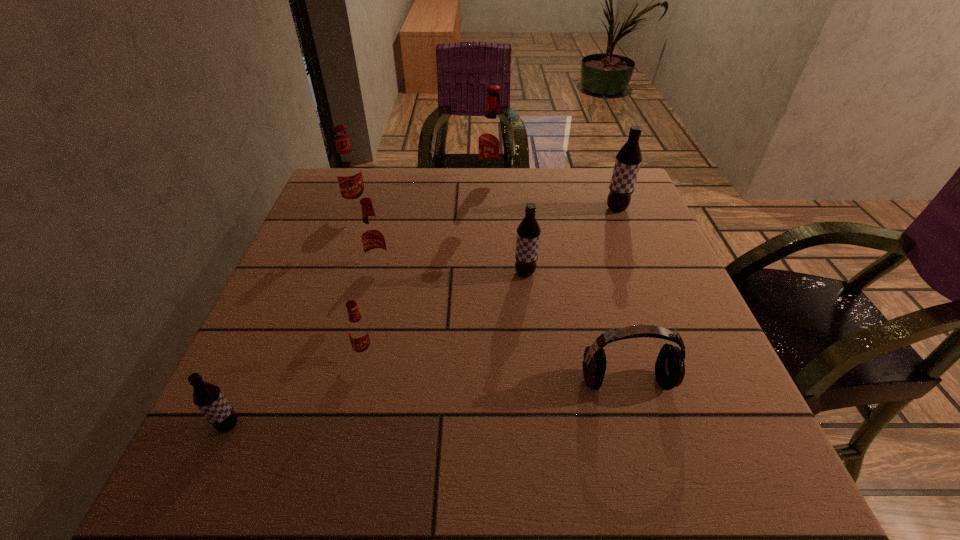
Image resolution: width=960 pixels, height=540 pixels. What are the coordinates of `the biggest red root beer` in the screenshot? It's located at (492, 139).

The width and height of the screenshot is (960, 540). Find the location of `the rightmost red root beer`. the rightmost red root beer is located at coordinates (492, 139).

The height and width of the screenshot is (540, 960). Identify the location of the seventh object from right to left. (348, 170).

Where is `the second root beer from left to right`? This screenshot has width=960, height=540. the second root beer from left to right is located at coordinates (348, 170).

Find the location of a particular element. the rightmost root beer is located at coordinates (628, 159).

Where is `the biggest brown root beer`? This screenshot has width=960, height=540. the biggest brown root beer is located at coordinates (628, 159).

Find the location of `the second smallest red root beer`. the second smallest red root beer is located at coordinates (373, 239).

This screenshot has height=540, width=960. What are the coordinates of `the second nearest brown root beer` in the screenshot? It's located at (528, 232).

You are a GUI agent. You are given a task and a screenshot of the screen. Output one action in this format:
    pyautogui.click(x=<x>, y=<y>)
    Task: Click on the second smallest brown root beer
    The width and height of the screenshot is (960, 540).
    Given the screenshot: What is the action you would take?
    pyautogui.click(x=528, y=232)

At what (x,y) coordinates should I click in order to perform the action: click on the seventh farthest object. Please return your answer as a coordinate pair (x, y). Looking at the image, I should click on (670, 367).